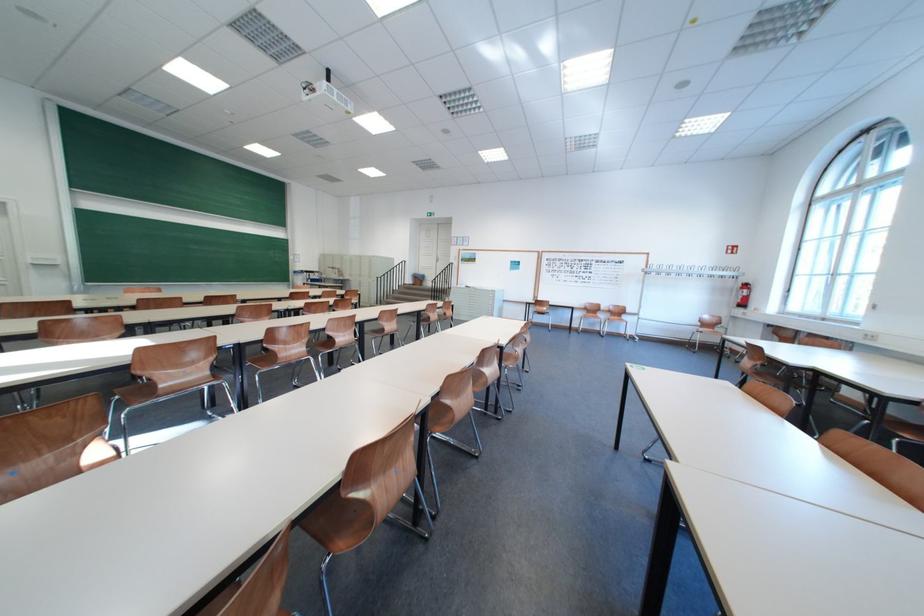
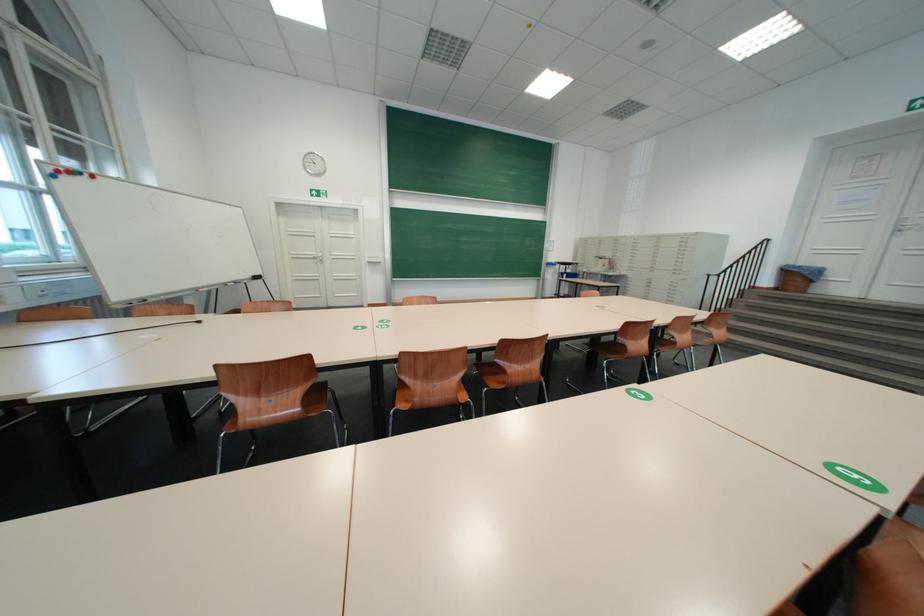
Locate, in the second image, the point that corresponds to [357,259] in the first image.

(630, 241)